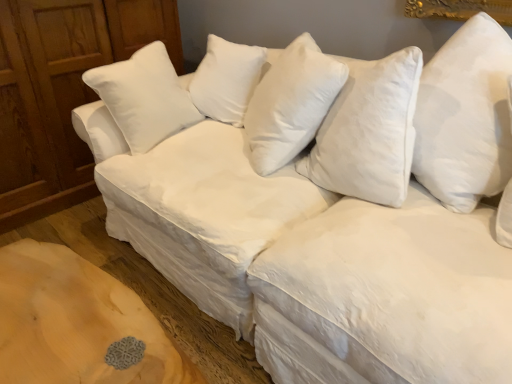
Question: Which direction should I rotate to look at white soft pillow at center, the 2th pillow viewed from the front?

Choices:
 (A) right
 (B) left

Answer: (A)

Question: From a real-world perspective, is white soft pillow at center, the 1th pillow positioned from the back, physically below wooden dresser at left?

Choices:
 (A) no
 (B) yes

Answer: (A)

Question: From the image's perspective, would you say white soft pillow at center, the 2th pillow viewed from the front, is positioned over wooden dresser at left?

Choices:
 (A) no
 (B) yes

Answer: (A)

Question: Can we say white soft pillow at center, the 2th pillow viewed from the front, lies outside wooden dresser at left?

Choices:
 (A) yes
 (B) no

Answer: (A)

Question: Can wooden dresser at left be found inside white soft pillow at center, the second pillow when ordered from right to left?

Choices:
 (A) yes
 (B) no

Answer: (B)

Question: Is white soft pillow at center, the 1th pillow positioned from the back, positioned behind wooden dresser at left?

Choices:
 (A) yes
 (B) no

Answer: (B)

Question: Can you confirm if white soft pillow at center, the second pillow when ordered from right to left, is taller than wooden dresser at left?

Choices:
 (A) no
 (B) yes

Answer: (A)

Question: Is white soft pillow at upper right, the second pillow positioned from the back, in contact with wooden dresser at left?

Choices:
 (A) no
 (B) yes

Answer: (A)

Question: Is the position of white soft pillow at upper right, marked as the 1th pillow in a right-to-left arrangement, less distant than that of wooden dresser at left?

Choices:
 (A) yes
 (B) no

Answer: (A)

Question: From the image's perspective, is white soft pillow at upper right, the second pillow positioned from the back, under wooden dresser at left?

Choices:
 (A) no
 (B) yes

Answer: (B)

Question: From a real-world perspective, is white soft pillow at upper right, marked as the 1th pillow in a right-to-left arrangement, positioned under wooden dresser at left based on gravity?

Choices:
 (A) no
 (B) yes

Answer: (A)

Question: Is white soft pillow at upper right, which is counted as the 2th pillow, starting from the left, facing away from wooden dresser at left?

Choices:
 (A) yes
 (B) no

Answer: (B)

Question: Is white soft pillow at upper right, acting as the first pillow starting from the front, located outside wooden dresser at left?

Choices:
 (A) yes
 (B) no

Answer: (A)

Question: Could you tell me if white soft pillow at center, the second pillow when ordered from right to left, is facing white soft pillow at upper right, which is counted as the 2th pillow, starting from the left?

Choices:
 (A) no
 (B) yes

Answer: (A)